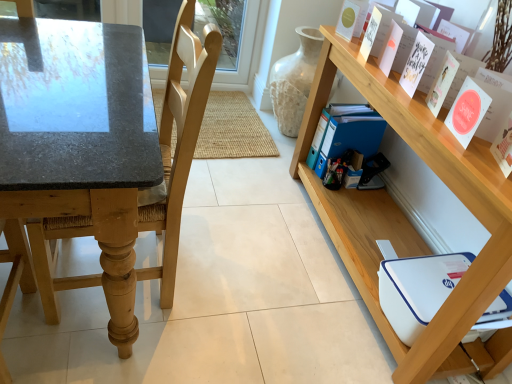
This screenshot has height=384, width=512. I want to click on vacant region to the left of matte pink card at upper right, the 2th paperback book viewed from the front, so point(434,125).